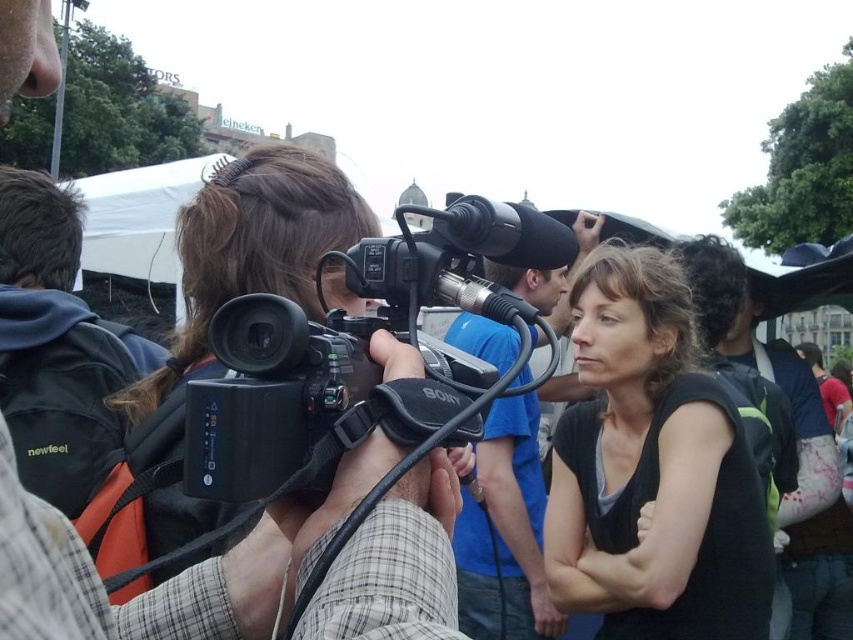
Question: Is black matte shirt at center thinner than black plastic camera at center?

Choices:
 (A) yes
 (B) no

Answer: (B)

Question: Which point appears closest to the camera in this image?

Choices:
 (A) (276, 316)
 (B) (480, 490)

Answer: (A)

Question: Which point appears farthest from the camera in this image?

Choices:
 (A) (15, 45)
 (B) (36, 480)
 (C) (535, 467)

Answer: (C)

Question: Is the position of black plastic camera at center more distant than that of blue fabric shirt at center?

Choices:
 (A) no
 (B) yes

Answer: (A)

Question: Which object is closer to the camera taking this photo?

Choices:
 (A) black plastic camera at center
 (B) black matte shirt at center

Answer: (A)

Question: Is black plastic camera at center wider than black fabric backpack at left?

Choices:
 (A) no
 (B) yes

Answer: (A)